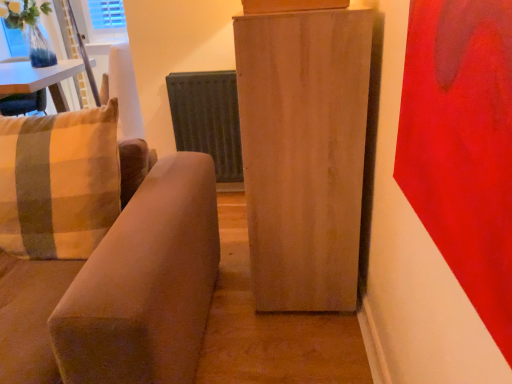
This screenshot has width=512, height=384. What do you see at coordinates (59, 182) in the screenshot?
I see `plaid fabric pillow at left` at bounding box center [59, 182].

In order to face metallic gray radiator at center, should I rotate leftwards or rightwards?

To face it directly, rotate left by 6.640 degrees.

Where is `plaid fabric pillow at left`? The image size is (512, 384). plaid fabric pillow at left is located at coordinates (x=59, y=182).

Considering the relative sizes of suede-like beige couch at left and metallic gray radiator at center in the image provided, is suede-like beige couch at left thinner than metallic gray radiator at center?

Incorrect, the width of suede-like beige couch at left is not less than that of metallic gray radiator at center.

In the scene shown: From a real-world perspective, is suede-like beige couch at left under metallic gray radiator at center?

Yes.

Does suede-like beige couch at left come behind metallic gray radiator at center?

No, it is in front of metallic gray radiator at center.

From the image's perspective, which object appears higher, suede-like beige couch at left or metallic gray radiator at center?

metallic gray radiator at center, from the image's perspective.

Would you say plaid fabric pillow at left is a long distance from metallic gray radiator at center?

Yes, plaid fabric pillow at left is far from metallic gray radiator at center.

You are a GUI agent. You are given a task and a screenshot of the screen. Output one action in this format:
    pyautogui.click(x=<x>, y=<y>)
    Task: Click on the radiator behind the plaid fabric pillow at left
    
    Given the screenshot: What is the action you would take?
    pyautogui.click(x=208, y=118)

Which point is more distant from viewer, (101, 175) or (231, 135)?

The point (231, 135) is farther from the camera.

Is plaid fabric pillow at left positioned behind metallic gray radiator at center?

No, it is not.

Considering the sizes of objects metallic gray radiator at center and suede-like beige couch at left in the image provided, who is smaller, metallic gray radiator at center or suede-like beige couch at left?

Smaller between the two is metallic gray radiator at center.

Locate an element on the screen. radiator behind the suede-like beige couch at left is located at coordinates (208, 118).

Considering the positions of point (209, 119) and point (128, 203), is point (209, 119) closer or farther from the camera than point (128, 203)?

Point (209, 119) appears to be farther away from the viewer than point (128, 203).

From the image's perspective, who appears lower, metallic gray radiator at center or suede-like beige couch at left?

suede-like beige couch at left appears lower in the image.

The image size is (512, 384). Find the location of `radiator that appears above the light wood cabinet at center (from the image's perspective)`. radiator that appears above the light wood cabinet at center (from the image's perspective) is located at coordinates (208, 118).

Is light wood cabinet at center smaller than metallic gray radiator at center?

Actually, light wood cabinet at center might be larger than metallic gray radiator at center.

Is the position of light wood cabinet at center more distant than that of metallic gray radiator at center?

That is False.

Considering the relative sizes of metallic gray radiator at center and light wood cabinet at center in the image provided, is metallic gray radiator at center wider than light wood cabinet at center?

No.

Which is correct: metallic gray radiator at center is inside light wood cabinet at center, or outside of it?

metallic gray radiator at center is spatially situated outside light wood cabinet at center.

Considering the sizes of objects metallic gray radiator at center and light wood cabinet at center in the image provided, who is smaller, metallic gray radiator at center or light wood cabinet at center?

metallic gray radiator at center is smaller.

Is metallic gray radiator at center looking in the opposite direction of light wood cabinet at center?

No, metallic gray radiator at center is not facing the opposite direction of light wood cabinet at center.

From the image's perspective, which is below, light wood cabinet at center or suede-like beige couch at left?

suede-like beige couch at left, from the image's perspective.

Considering the sizes of objects light wood cabinet at center and suede-like beige couch at left in the image provided, who is taller, light wood cabinet at center or suede-like beige couch at left?

light wood cabinet at center.

Is point (361, 189) farther from viewer compared to point (215, 218)?

No, (361, 189) is closer to viewer.

Is light wood cabinet at center not within suede-like beige couch at left?

Indeed, light wood cabinet at center is completely outside suede-like beige couch at left.

Between light wood cabinet at center and plaid fabric pillow at left, which one appears on the right side from the viewer's perspective?

light wood cabinet at center is more to the right.

Which object is further away from the camera, light wood cabinet at center or plaid fabric pillow at left?

Positioned behind is light wood cabinet at center.

From the image's perspective, relative to plaid fabric pillow at left, is light wood cabinet at center above or below?

Clearly, from the image's perspective, light wood cabinet at center is above plaid fabric pillow at left.

Where is `studio couch located underneath the metallic gray radiator at center (from a real-world perspective)`? This screenshot has height=384, width=512. studio couch located underneath the metallic gray radiator at center (from a real-world perspective) is located at coordinates (101, 255).

Identify the location of pillow on the left of metallic gray radiator at center. (59, 182).

From the image, which object appears to be nearer to plaid fabric pillow at left, light wood cabinet at center or suede-like beige couch at left?

Among the two, suede-like beige couch at left is located nearer to plaid fabric pillow at left.

From the image, which object appears to be farther from suede-like beige couch at left, metallic gray radiator at center or light wood cabinet at center?

metallic gray radiator at center is positioned further to the anchor suede-like beige couch at left.

When comparing their distances from light wood cabinet at center, does plaid fabric pillow at left or metallic gray radiator at center seem further?

metallic gray radiator at center lies further to light wood cabinet at center than the other object.

Considering their positions, is metallic gray radiator at center positioned further to plaid fabric pillow at left than light wood cabinet at center?

The object further to plaid fabric pillow at left is metallic gray radiator at center.

Estimate the real-world distances between objects in this image. Which object is closer to light wood cabinet at center, suede-like beige couch at left or metallic gray radiator at center?

suede-like beige couch at left lies closer to light wood cabinet at center than the other object.

Looking at the image, which one is located closer to suede-like beige couch at left, light wood cabinet at center or plaid fabric pillow at left?

plaid fabric pillow at left is positioned closer to the anchor suede-like beige couch at left.

Considering their positions, is light wood cabinet at center positioned closer to metallic gray radiator at center than plaid fabric pillow at left?

A: Among the two, light wood cabinet at center is located nearer to metallic gray radiator at center.

Looking at the image, which one is located further to suede-like beige couch at left, plaid fabric pillow at left or metallic gray radiator at center?

The object further to suede-like beige couch at left is metallic gray radiator at center.

Find the location of a particular element. furniture located between suede-like beige couch at left and metallic gray radiator at center in the depth direction is located at coordinates (304, 153).

I want to click on furniture positioned between plaid fabric pillow at left and metallic gray radiator at center from near to far, so click(x=304, y=153).

The height and width of the screenshot is (384, 512). In order to click on pillow located between suede-like beige couch at left and light wood cabinet at center in the left-right direction in this screenshot , I will do `click(59, 182)`.

Where is `pillow positioned between suede-like beige couch at left and metallic gray radiator at center from near to far`? The width and height of the screenshot is (512, 384). pillow positioned between suede-like beige couch at left and metallic gray radiator at center from near to far is located at coordinates (59, 182).